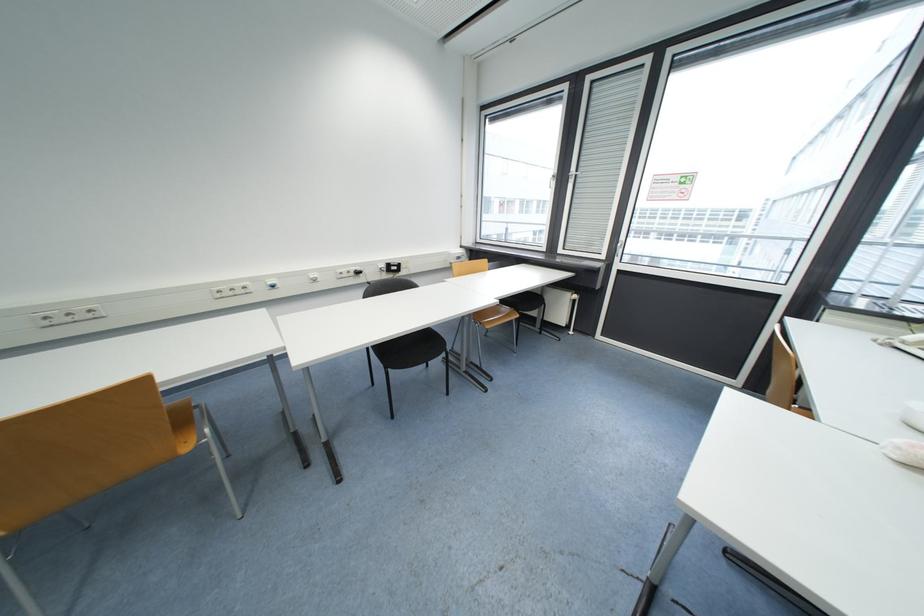
Where would you pull the blind pull strap? Please return your answer as a coordinate pair (x, y).

(601, 158)